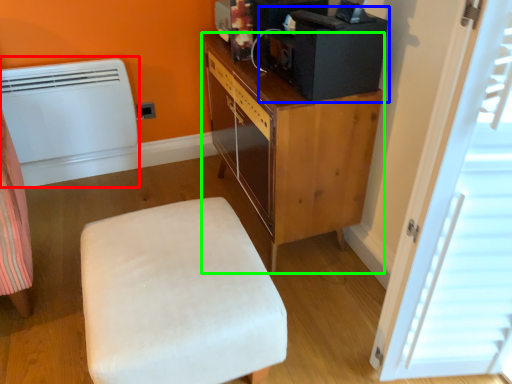
Question: Based on their relative distances, which object is farther from heater (highlighted by a red box)? Choose from desktop computer (highlighted by a blue box) and cabinetry (highlighted by a green box).

Choices:
 (A) desktop computer
 (B) cabinetry

Answer: (A)